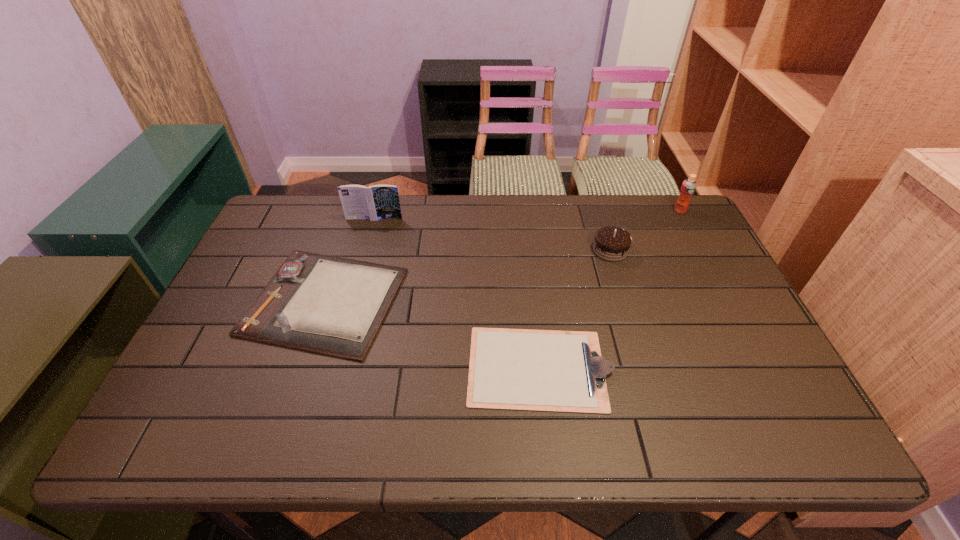
Locate an element on the screen. Image resolution: width=960 pixels, height=540 pixels. unoccupied position between the right clipboard and the third tallest object is located at coordinates (575, 309).

At what (x,y) coordinates should I click in order to perform the action: click on free space between the chocolate cake and the book. Please return your answer as a coordinate pair (x, y). The image size is (960, 540). Looking at the image, I should click on point(492,234).

Identify the location of free spot between the rightmost object and the second farthest object. (527, 215).

You are a GUI agent. You are given a task and a screenshot of the screen. Output one action in this format:
    pyautogui.click(x=<x>, y=<y>)
    Task: Click on the object that stands as the third closest to the fourth object from left to right
    
    Given the screenshot: What is the action you would take?
    pyautogui.click(x=324, y=304)

Find the location of `object that is the nearest to the left clipboard`. object that is the nearest to the left clipboard is located at coordinates (376, 202).

Identify the location of free space that satisfies the following two spatial constraints: 1. on the front cover of the book; 2. on the left side of the third object from right to left. (333, 368).

Find the location of a particular element. vacant space that satisfies the following two spatial constraints: 1. on the front cover of the book; 2. on the left side of the right clipboard is located at coordinates (333, 368).

Image resolution: width=960 pixels, height=540 pixels. In order to click on blank space that satisfies the following two spatial constraints: 1. on the back side of the chocolate cake; 2. on the right side of the left clipboard in this screenshot , I will do `click(342, 250)`.

Image resolution: width=960 pixels, height=540 pixels. In order to click on vacant space that satisfies the following two spatial constraints: 1. on the back side of the left clipboard; 2. on the right side of the orange juice in this screenshot , I will do `click(355, 211)`.

The height and width of the screenshot is (540, 960). Find the location of `free location that satisfies the following two spatial constraints: 1. on the front cover of the book; 2. on the left side of the right clipboard`. free location that satisfies the following two spatial constraints: 1. on the front cover of the book; 2. on the left side of the right clipboard is located at coordinates (333, 368).